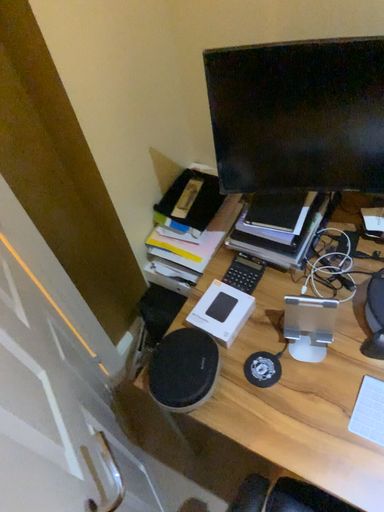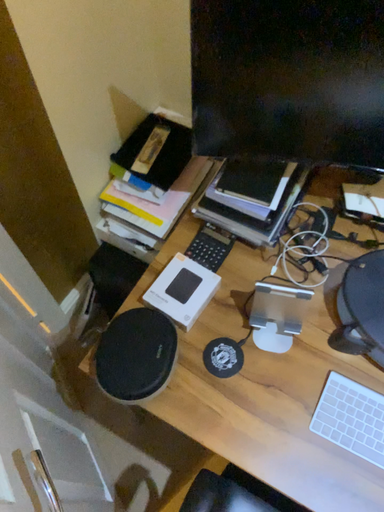
Question: How did the camera likely rotate when shooting the video?

Choices:
 (A) rotated upward
 (B) rotated downward

Answer: (B)